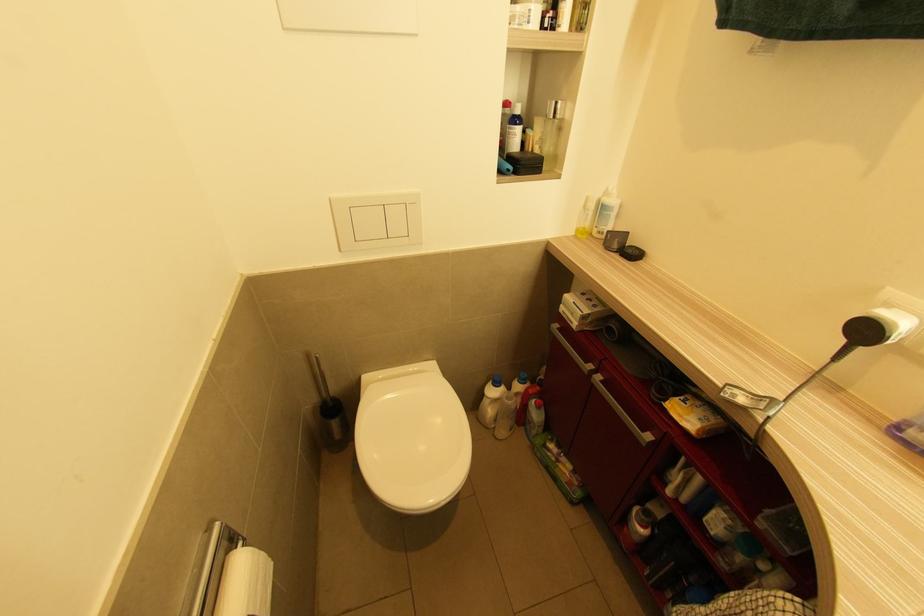
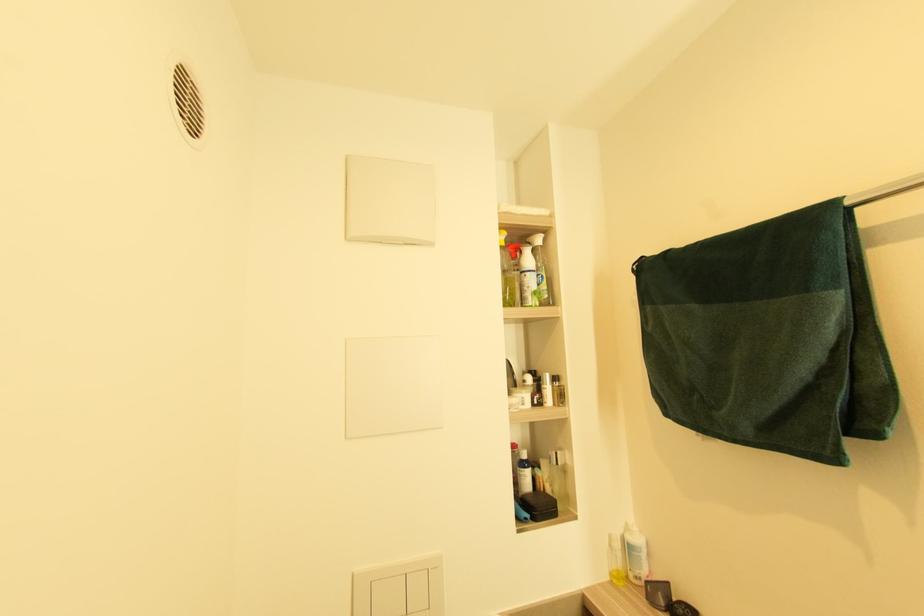
Question: Based on the continuous images, in which direction is the camera rotating? Reply with the corresponding letter.

Choices:
 (A) Left
 (B) Right
 (C) Up
 (D) Down

Answer: (C)